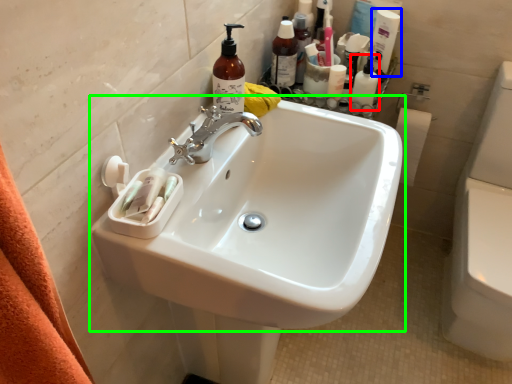
Question: Which is nearer to the toiletry (highlighted by a red box)? cleaning product (highlighted by a blue box) or sink (highlighted by a green box).

Choices:
 (A) cleaning product
 (B) sink

Answer: (A)